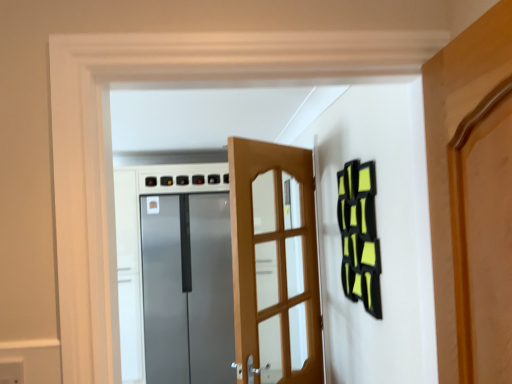
Question: From a real-world perspective, is matte gray electric outlet at lower left on wooden door at center, arranged as the second door when viewed from the back?

Choices:
 (A) no
 (B) yes

Answer: (B)

Question: Is matte gray electric outlet at lower left smaller than wooden door at center, positioned as the first door in right-to-left order?

Choices:
 (A) yes
 (B) no

Answer: (A)

Question: From a real-world perspective, is matte gray electric outlet at lower left physically below wooden door at center, acting as the first door starting from the front?

Choices:
 (A) yes
 (B) no

Answer: (B)

Question: Is matte gray electric outlet at lower left bigger than wooden door at center, arranged as the second door when viewed from the back?

Choices:
 (A) yes
 (B) no

Answer: (B)

Question: Is matte gray electric outlet at lower left thinner than wooden door at center, positioned as the first door in right-to-left order?

Choices:
 (A) yes
 (B) no

Answer: (A)

Question: From the image's perspective, does matte gray electric outlet at lower left appear higher than wooden door at center, positioned as the first door in right-to-left order?

Choices:
 (A) no
 (B) yes

Answer: (B)

Question: Does wooden door at center, acting as the first door starting from the front, have a greater height compared to matte gray electric outlet at lower left?

Choices:
 (A) no
 (B) yes

Answer: (B)

Question: From a real-world perspective, does wooden door at center, arranged as the second door when viewed from the back, stand above matte gray electric outlet at lower left?

Choices:
 (A) no
 (B) yes

Answer: (A)

Question: Can you confirm if wooden door at center, positioned as the first door in right-to-left order, is bigger than matte gray electric outlet at lower left?

Choices:
 (A) no
 (B) yes

Answer: (B)

Question: Is wooden door at center, the second door from the left, at the right side of matte gray electric outlet at lower left?

Choices:
 (A) no
 (B) yes

Answer: (B)

Question: Is wooden door at center, arranged as the second door when viewed from the back, positioned before matte gray electric outlet at lower left?

Choices:
 (A) yes
 (B) no

Answer: (B)

Question: Is wooden door at center, the second door from the left, outside matte gray electric outlet at lower left?

Choices:
 (A) yes
 (B) no

Answer: (A)

Question: Does satin metallic refrigerator at center, placed as the first door when sorted from left to right, come in front of wooden door at center, positioned as the first door in right-to-left order?

Choices:
 (A) yes
 (B) no

Answer: (B)